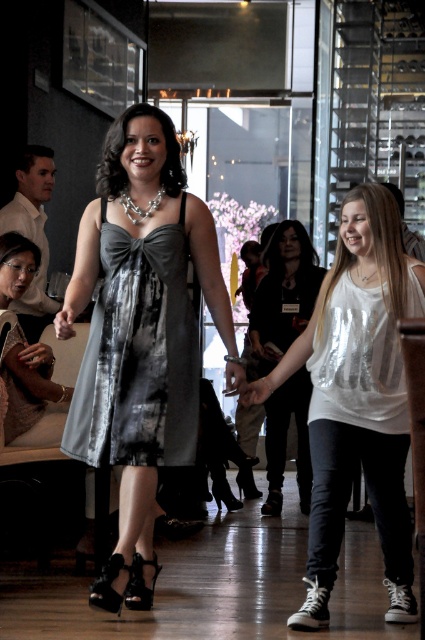
You are planning to take a photo of the shiny metallic dress at center in the scene. Based on its position, where should you aim your camera to capture it best?

The shiny metallic dress at center is located at point (138, 355), so you should aim your camera slightly to the right and down from the center of the image to capture it best.